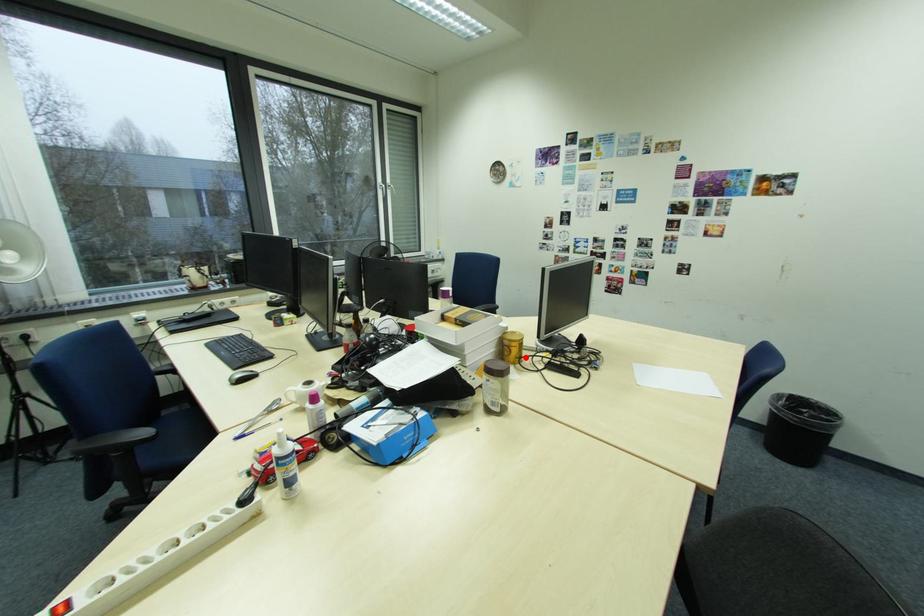
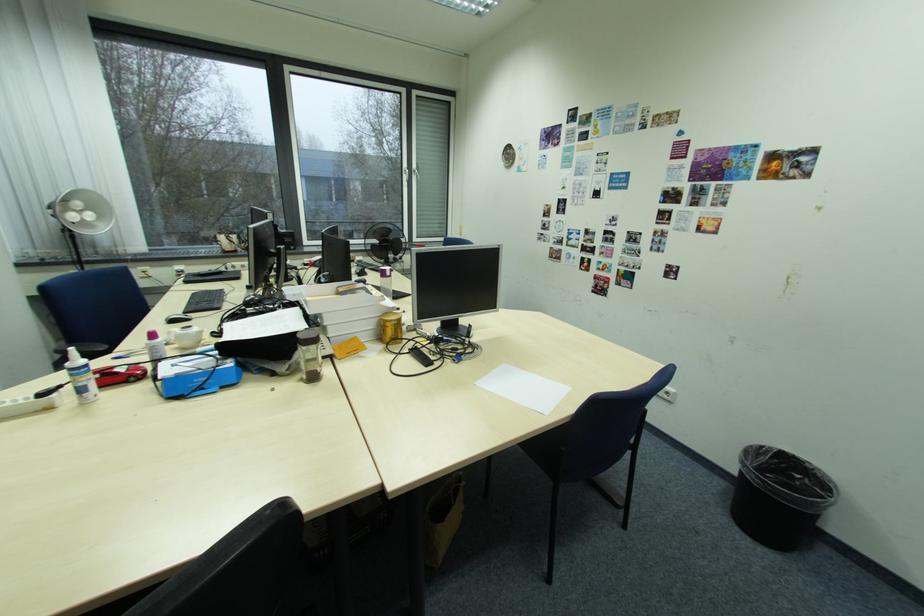
Question: I am providing you with two images of the same scene from different viewpoints. A red point is marked on the first image. Is the red point's position out of view in image 2?

Choices:
 (A) Yes
 (B) No

Answer: (B)